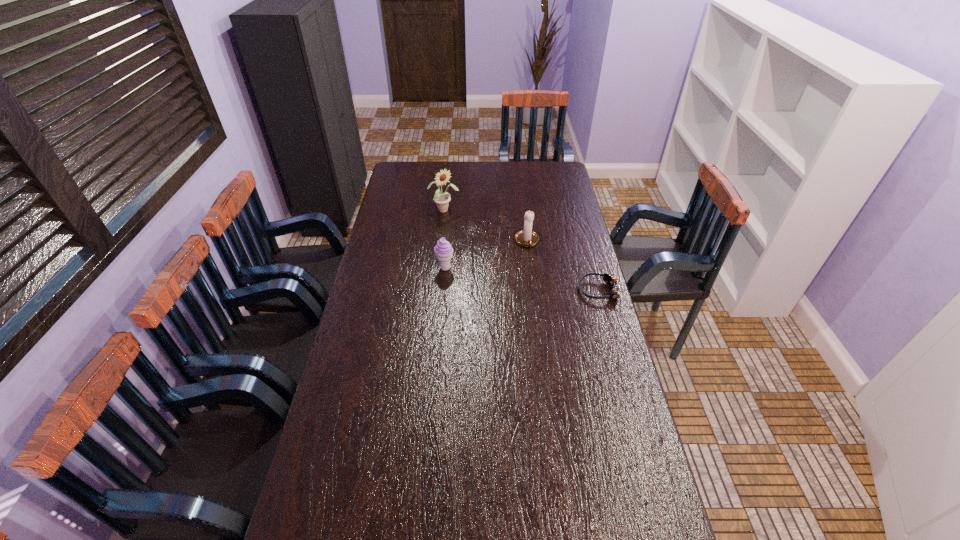
Where is `vacant space located through the lenses of the goggles`? The width and height of the screenshot is (960, 540). vacant space located through the lenses of the goggles is located at coordinates (513, 290).

I want to click on free space located on the handle side of the third nearest object, so click(543, 292).

At what (x,y) coordinates should I click in order to perform the action: click on vacant space located on the handle side of the third nearest object. Please return your answer as a coordinate pair (x, y). The height and width of the screenshot is (540, 960). Looking at the image, I should click on (549, 309).

Locate an element on the screen. The height and width of the screenshot is (540, 960). free space located on the handle side of the third nearest object is located at coordinates (550, 313).

The width and height of the screenshot is (960, 540). Identify the location of free space located 0.060m on the front-facing side of the sunflower. (459, 221).

Find the location of a particular element. This screenshot has height=540, width=960. free space located 0.400m on the front-facing side of the sunflower is located at coordinates (503, 262).

Locate an element on the screen. The height and width of the screenshot is (540, 960). free region located on the front-facing side of the sunflower is located at coordinates (503, 262).

The width and height of the screenshot is (960, 540). What are the coordinates of `object present at the right edge` in the screenshot? It's located at (611, 280).

At what (x,y) coordinates should I click in order to perform the action: click on vacant space at the far edge. Please return your answer as a coordinate pair (x, y). Looking at the image, I should click on (494, 165).

This screenshot has width=960, height=540. In the image, there is a desktop. Find the location of `vacant space at the near edge`. vacant space at the near edge is located at coordinates (564, 528).